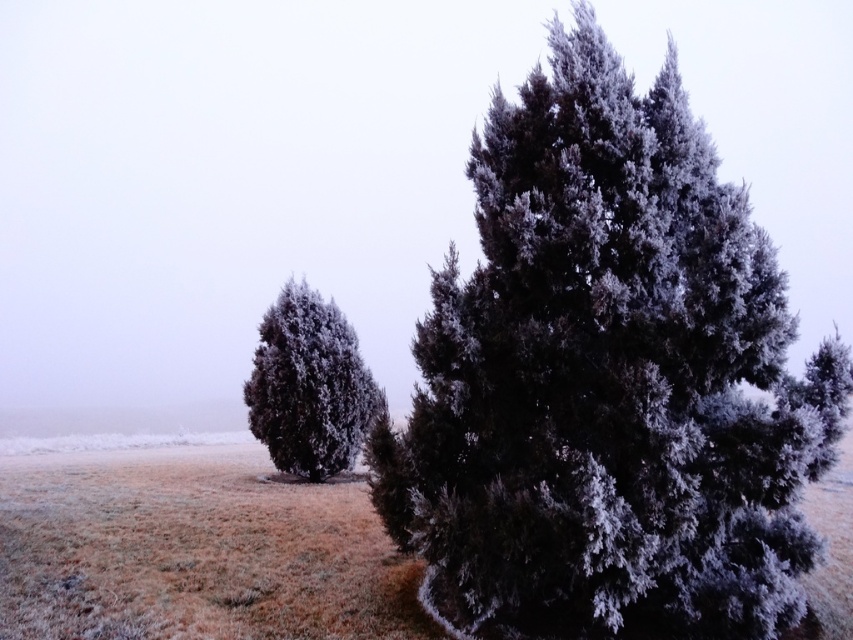
Does frosted dark green tree at center appear over frosted dark green tree at left?

Yes, frosted dark green tree at center is above frosted dark green tree at left.

Which is more to the right, frosted dark green tree at center or frosted dark green tree at left?

From the viewer's perspective, frosted dark green tree at center appears more on the right side.

The width and height of the screenshot is (853, 640). Find the location of `frosted dark green tree at center`. frosted dark green tree at center is located at coordinates (608, 380).